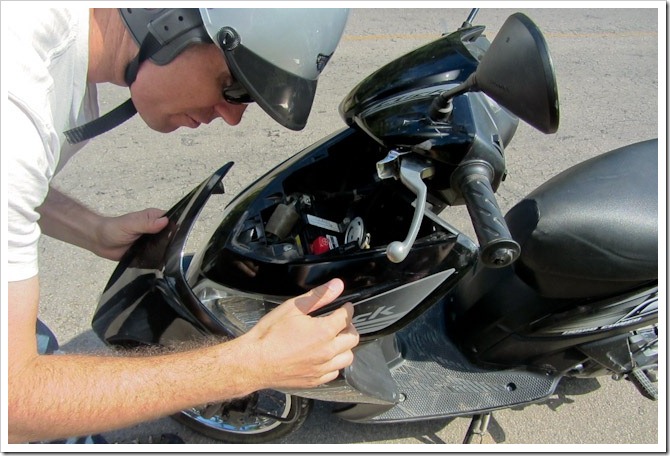
Find the location of a particular element. handle is located at coordinates (486, 209).